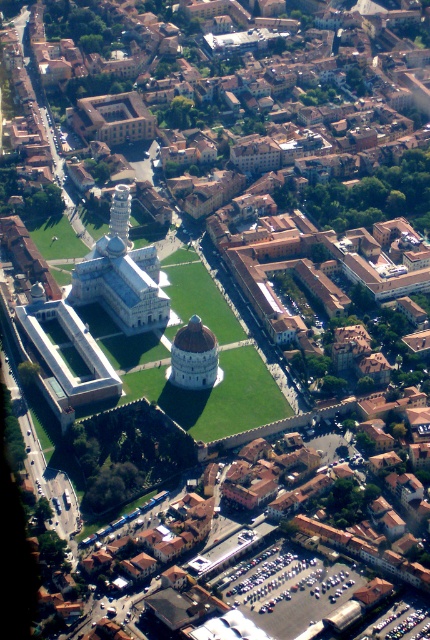
Question: Among these objects, which one is farthest from the camera?

Choices:
 (A) white stone tower at center
 (B) smooth white tower at center

Answer: (B)

Question: Which is nearer to the white stone tower at center?

Choices:
 (A) smooth white tower at center
 (B) white marble dome at center

Answer: (A)

Question: Observing the image, what is the correct spatial positioning of white stone tower at center in reference to smooth white tower at center?

Choices:
 (A) above
 (B) below

Answer: (B)

Question: Is white stone tower at center smaller than white marble dome at center?

Choices:
 (A) yes
 (B) no

Answer: (B)

Question: Does white stone tower at center have a larger size compared to white marble dome at center?

Choices:
 (A) yes
 (B) no

Answer: (A)

Question: Which of the following is the closest to the observer?

Choices:
 (A) (122, 198)
 (B) (205, 339)

Answer: (B)